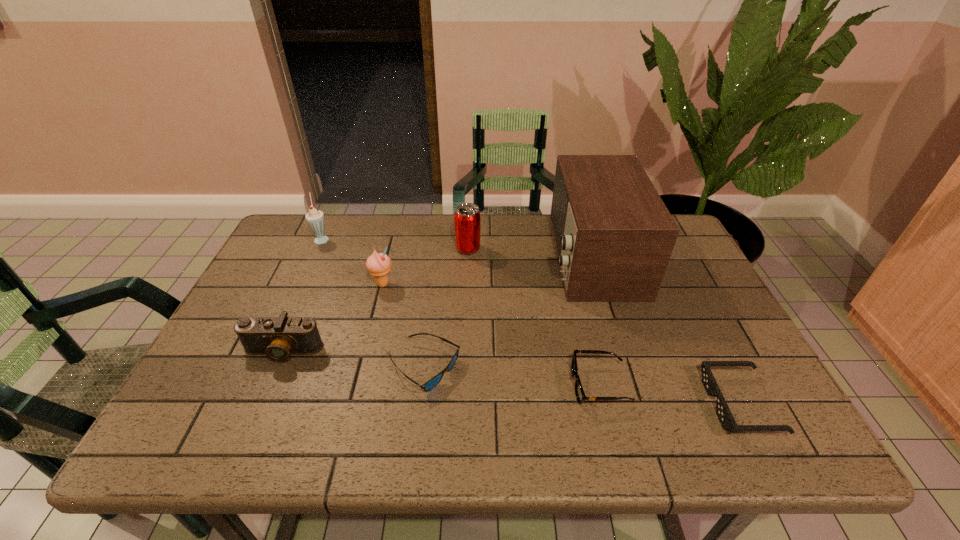
Locate an element on the screen. object located in the far left corner section of the desktop is located at coordinates (315, 218).

Identify the location of object located in the near right corner section of the desktop. (727, 421).

In the image, there is a desktop. Where is `vacant area at the far edge`? vacant area at the far edge is located at coordinates (396, 214).

Identify the location of vacant area at the near edge. (261, 422).

The image size is (960, 540). I want to click on vacant space at the left edge of the desktop, so click(x=265, y=298).

You are a GUI agent. You are given a task and a screenshot of the screen. Output one action in this format:
    pyautogui.click(x=<x>, y=<y>)
    Task: Click on the vacant space at the right edge of the desktop
    This screenshot has width=960, height=540.
    Given the screenshot: What is the action you would take?
    pyautogui.click(x=700, y=316)

Image resolution: width=960 pixels, height=540 pixels. I want to click on free point between the soda can and the milkshake, so click(x=396, y=244).

Find the location of `unoccupied position between the tallest object and the icecream`. unoccupied position between the tallest object and the icecream is located at coordinates (488, 271).

This screenshot has width=960, height=540. In order to click on free space between the tallest object and the rightmost object in this screenshot , I will do (666, 330).

Identify the location of empty space between the second sunglasses from right to left and the soda can. (534, 317).